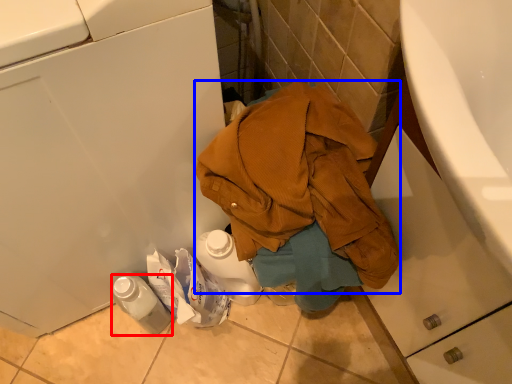
Question: Which of the following is the farthest to the observer, bottle (highlighted by a red box) or waste (highlighted by a blue box)?

Choices:
 (A) bottle
 (B) waste

Answer: (A)